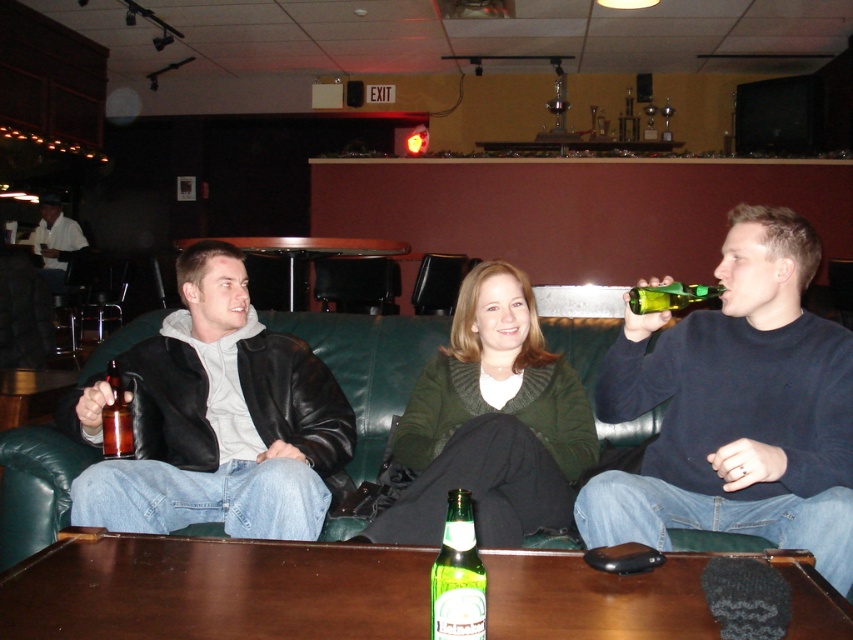
In the scene shown: You are a photographer setting up a shoot in this scene. You need to place a 12 inch wide backdrop stand between the matte black jacket at center and the green knitted sweater at center. Given their widths, will the stand fit between them?

The matte black jacket at center is wider than the green knitted sweater at center. Since the stand requires 12 inches of space, but the description only provides relative width comparisons without specific measurements, it is unclear if the available space between them can accommodate the stand. Additional information about the actual distance between the two items is needed to determine feasibility.

You are a bartender preparing a drink for the person wearing the green knitted sweater at center. The green glass bottle at center contains the drink you need to serve. Can you place the bottle directly on the table without it being covered by the sweater?

The green knitted sweater at center is larger in size than the green glass bottle at center, so placing the bottle on the table might result in the sweater covering it if not positioned carefully.

You are standing in the bar and want to take a photo of the group on the green leather couch. The camera you are using has a focal length of 50mm and an aperture of f2.8. To ensure the entire group is in focus, what is the minimum distance you should be from the point at coordinates point (4, 436) to capture the group effectively?

The minimum distance you should be from the point at coordinates point (4, 436) is 2.06 meters to ensure the entire group on the green leather couch is in focus.